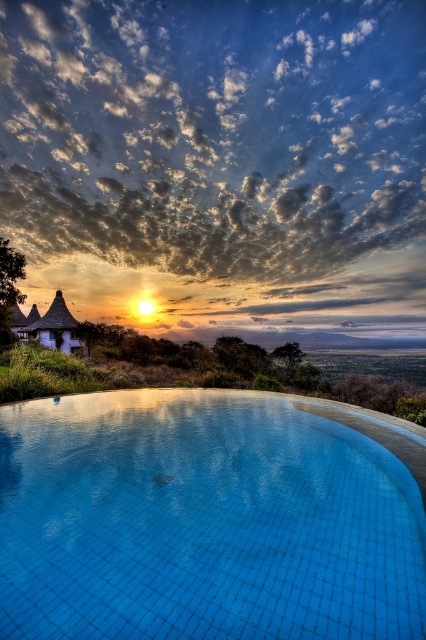
You are standing at the edge of the blue tile swimming pool at lower center and want to reach the wooden thatched hut at left. Which direction should you walk to get there?

The blue tile swimming pool at lower center is positioned on the right side of wooden thatched hut at left, so you should walk to the left to reach the wooden thatched hut at left.

You are standing at the infinity pool and looking towards the distant landscape. There are two points marked in the image. The first point is at coordinates point (204, 564) and the second is at point (20, 332). Which of these two points is closer to you?

Point (204, 564) is in front of point (20, 332), so the first point is closer to you.